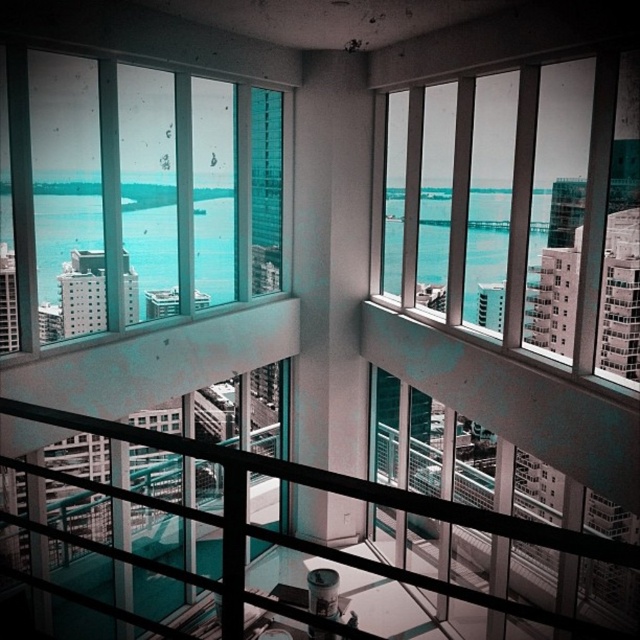
You are standing on the balcony and want to take a photo of the cityscape. To avoid the black metal railing at center appearing in the shot, should you aim your camera to the left or right of the transparent glass window at upper left?

You should aim your camera to the left of the transparent glass window at upper left because the transparent glass window at upper left is positioned on the left side of the black metal railing at center, so moving left would avoid the railing.

You are standing in the apartment and want to look out through the transparent glass window at upper left. Where should you position yourself to see the point at coordinates (136, 195)?

The point at coordinates (136, 195) corresponds to the transparent glass window at upper left, so you should position yourself near the transparent glass window at upper left to see it.

You are standing in the apartment and want to take a photo of the city view. Which window should you use if you want to capture both the modern buildings and the water body in the same frame? Please choose between the transparent glass window at upper left and the clear glass windows at upper right.

Both the transparent glass window at upper left and the clear glass windows at upper right offer views of the city and water body. However, since the transparent glass window at upper left is positioned to the left of the clear glass windows at upper right, it might provide a wider or different angle to include both elements in the frame.